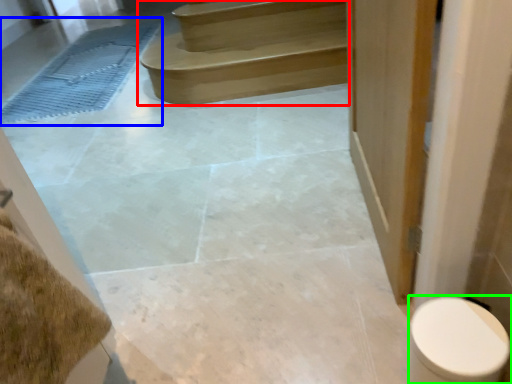
Question: Considering the real-world distances, which object is closest to stairs (highlighted by a red box)? bath mat (highlighted by a blue box) or toilet (highlighted by a green box).

Choices:
 (A) bath mat
 (B) toilet

Answer: (A)